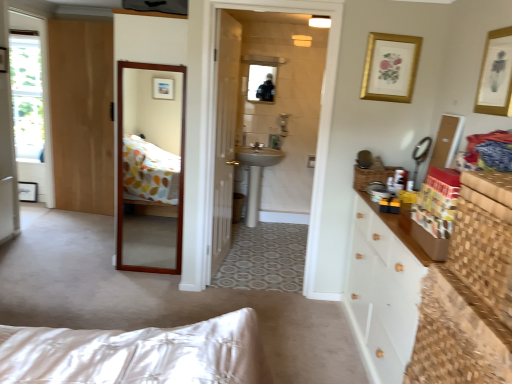
Question: Which direction should I rotate to look at translucent glass door at center, the second door when ordered from back to front, — up or down?

Choices:
 (A) up
 (B) down

Answer: (A)

Question: Can you confirm if glossy glass mirror at upper center, marked as the 1th mirror in a top-to-bottom arrangement, is bigger than translucent glass door at center, the second door in the left-to-right sequence?

Choices:
 (A) yes
 (B) no

Answer: (B)

Question: From the image's perspective, is glossy glass mirror at upper center, acting as the first mirror starting from the back, below translucent glass door at center, the second door in the left-to-right sequence?

Choices:
 (A) yes
 (B) no

Answer: (B)

Question: Is the surface of glossy glass mirror at upper center, the 2th mirror from the bottom, in direct contact with translucent glass door at center, the first door viewed from the right?

Choices:
 (A) yes
 (B) no

Answer: (B)

Question: From a real-world perspective, does glossy glass mirror at upper center, the 1th mirror viewed from the left, stand above translucent glass door at center, the second door in the left-to-right sequence?

Choices:
 (A) yes
 (B) no

Answer: (A)

Question: Could you tell me if glossy glass mirror at upper center, marked as the 1th mirror in a top-to-bottom arrangement, is turned towards translucent glass door at center, the first door viewed from the right?

Choices:
 (A) yes
 (B) no

Answer: (A)

Question: From a real-world perspective, does glossy glass mirror at upper center, marked as the 1th mirror in a top-to-bottom arrangement, sit lower than translucent glass door at center, the second door when ordered from back to front?

Choices:
 (A) yes
 (B) no

Answer: (B)

Question: Are white wood cabinet at right, the 2th cabinetry in the front-to-back sequence, and metallic silver mirror at upper right, the second mirror from the back, beside each other?

Choices:
 (A) yes
 (B) no

Answer: (B)

Question: From the image's perspective, is white wood cabinet at right, the 2th cabinetry in the front-to-back sequence, beneath metallic silver mirror at upper right, the first mirror in the front-to-back sequence?

Choices:
 (A) no
 (B) yes

Answer: (B)

Question: From a real-world perspective, is white wood cabinet at right, placed as the first cabinetry when sorted from back to front, positioned under metallic silver mirror at upper right, which is the first mirror in right-to-left order, based on gravity?

Choices:
 (A) no
 (B) yes

Answer: (B)

Question: Does white wood cabinet at right, the 2th cabinetry in the front-to-back sequence, appear on the left side of metallic silver mirror at upper right, positioned as the 2th mirror in top-to-bottom order?

Choices:
 (A) no
 (B) yes

Answer: (B)

Question: Is white wood cabinet at right, placed as the first cabinetry when sorted from back to front, turned away from metallic silver mirror at upper right, positioned as the 2th mirror in top-to-bottom order?

Choices:
 (A) no
 (B) yes

Answer: (A)

Question: From a real-world perspective, is white wood cabinet at right, placed as the first cabinetry when sorted from back to front, physically above metallic silver mirror at upper right, which is the first mirror in right-to-left order?

Choices:
 (A) no
 (B) yes

Answer: (A)

Question: Considering the relative sizes of woven wood chest at right, the second cabinetry when ordered from back to front, and white ceramic sink at center in the image provided, is woven wood chest at right, the second cabinetry when ordered from back to front, bigger than white ceramic sink at center?

Choices:
 (A) yes
 (B) no

Answer: (B)